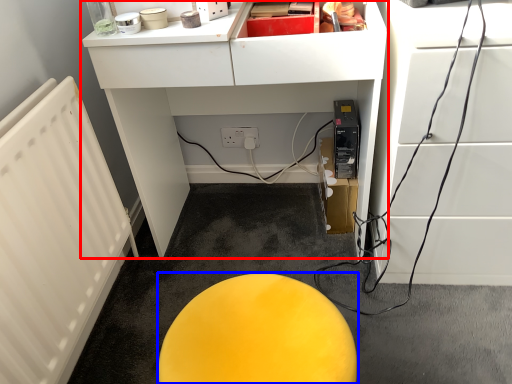
Question: Which point is further to the camera, furniture (highlighted by a red box) or furniture (highlighted by a blue box)?

Choices:
 (A) furniture
 (B) furniture

Answer: (A)